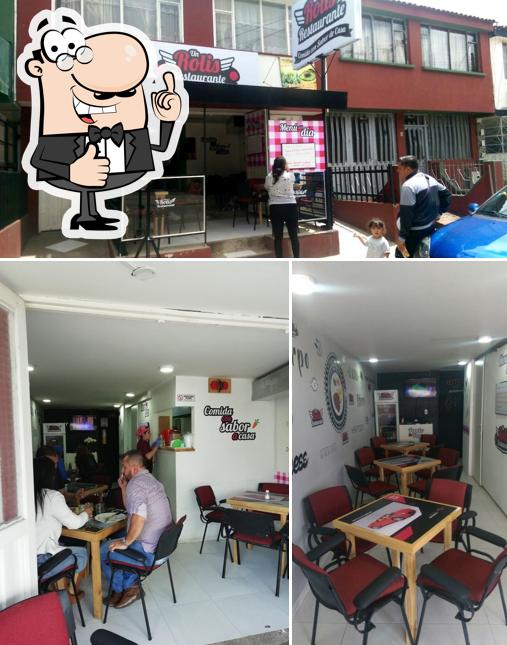
Where is `table legs`? The height and width of the screenshot is (645, 507). table legs is located at coordinates (410, 564), (445, 530), (95, 556).